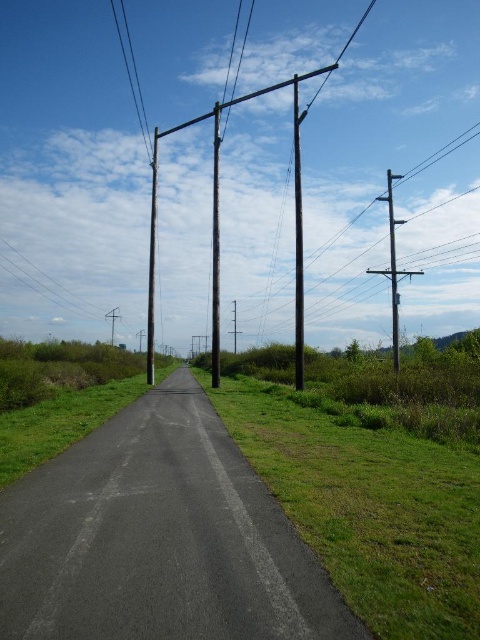
You are standing at the point with coordinates point (158, 538). What is the object directly beneath your feet?

The point (158, 538) corresponds to the black asphalt road at center, so the object directly beneath your feet is the black asphalt road at center.

In the scene shown: Please look at the image and identify the object located at the coordinates point (131, 68). What is it?

The point (131, 68) corresponds to the smooth wire at upper left.

What is the 2D coordinate of the smooth wire at upper left in the image?

The smooth wire at upper left is located at the 2D coordinate point of (x=131, y=68).